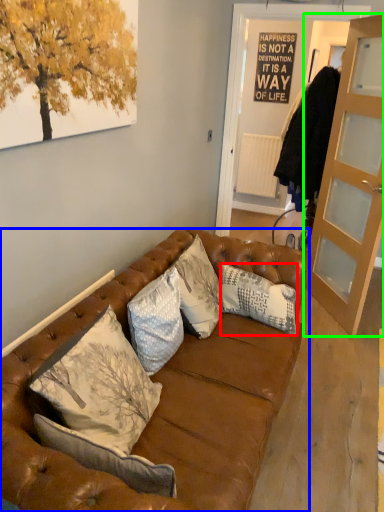
Question: Which object is positioned closest to pillow (highlighted by a red box)? Select from studio couch (highlighted by a blue box) and cabinetry (highlighted by a green box).

Choices:
 (A) studio couch
 (B) cabinetry

Answer: (A)